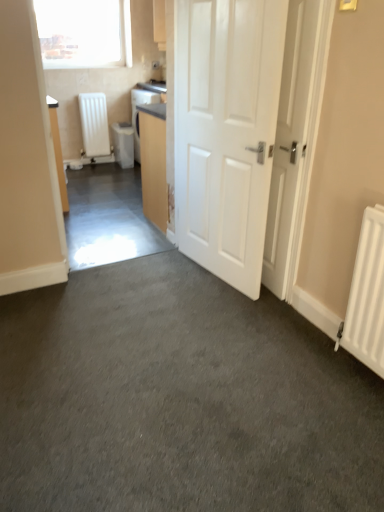
Question: Is white plastic water heater at center-left, which is counted as the 1th water heater, starting from the right, turned away from white matte radiator at left, which appears as the first water heater when viewed from the left?

Choices:
 (A) no
 (B) yes

Answer: (A)

Question: Is white plastic water heater at center-left, arranged as the 2th water heater when viewed from the left, positioned beyond the bounds of white matte radiator at left, which appears as the first water heater when viewed from the left?

Choices:
 (A) no
 (B) yes

Answer: (B)

Question: Are white plastic water heater at center-left, arranged as the 2th water heater when viewed from the left, and white matte radiator at left, positioned as the second water heater in right-to-left order, far apart?

Choices:
 (A) no
 (B) yes

Answer: (A)

Question: Can white matte radiator at left, positioned as the second water heater in right-to-left order, be found inside white plastic water heater at center-left, arranged as the 2th water heater when viewed from the left?

Choices:
 (A) yes
 (B) no

Answer: (B)

Question: Is white plastic water heater at center-left, arranged as the 2th water heater when viewed from the left, closer to the viewer compared to white matte radiator at left, which appears as the first water heater when viewed from the left?

Choices:
 (A) no
 (B) yes

Answer: (A)

Question: Is white plastic water heater at center-left, arranged as the 2th water heater when viewed from the left, shorter than white matte radiator at left, which appears as the first water heater when viewed from the left?

Choices:
 (A) yes
 (B) no

Answer: (A)

Question: Is matte wood cabinet at center not within white glossy door at center, the 2th door when ordered from right to left?

Choices:
 (A) no
 (B) yes

Answer: (B)

Question: Is matte wood cabinet at center positioned behind white glossy door at center, which is counted as the 1th door, starting from the left?

Choices:
 (A) no
 (B) yes

Answer: (B)

Question: Are matte wood cabinet at center and white glossy door at center, which is counted as the 1th door, starting from the left, making contact?

Choices:
 (A) no
 (B) yes

Answer: (A)

Question: Is matte wood cabinet at center facing away from white glossy door at center, which is counted as the 1th door, starting from the left?

Choices:
 (A) yes
 (B) no

Answer: (A)

Question: Can you confirm if matte wood cabinet at center is bigger than white glossy door at center, the 2th door when ordered from right to left?

Choices:
 (A) yes
 (B) no

Answer: (B)

Question: Considering the relative sizes of matte wood cabinet at center and white glossy door at center, which is counted as the 1th door, starting from the left, in the image provided, is matte wood cabinet at center taller than white glossy door at center, which is counted as the 1th door, starting from the left,?

Choices:
 (A) no
 (B) yes

Answer: (A)

Question: Can you confirm if white matte door at center, marked as the 2th door in a left-to-right arrangement, is positioned to the right of white glossy door at center, the 2th door when ordered from right to left?

Choices:
 (A) yes
 (B) no

Answer: (A)